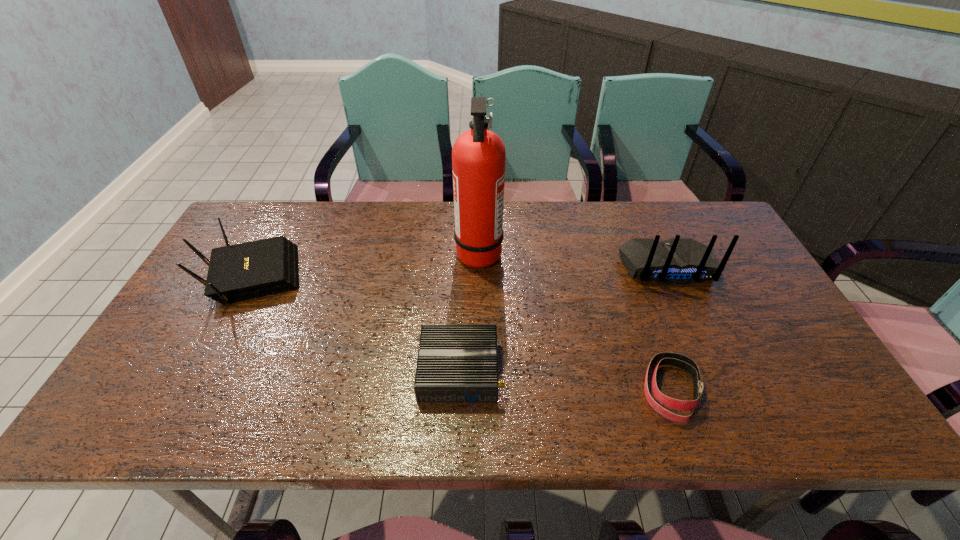
This screenshot has width=960, height=540. I want to click on vacant space at the far edge, so click(550, 228).

The height and width of the screenshot is (540, 960). Find the location of `free space at the left edge`. free space at the left edge is located at coordinates (159, 348).

In the image, there is a desktop. Find the location of `vacant space at the right edge`. vacant space at the right edge is located at coordinates (777, 374).

This screenshot has height=540, width=960. Identify the location of vacant area that lies between the shortest router and the fire extinguisher. (469, 311).

Locate an element on the screen. The image size is (960, 540). empty location between the second shortest object and the second tallest object is located at coordinates (564, 318).

Identify the location of blank region between the rightmost router and the leftmost object. The width and height of the screenshot is (960, 540). (459, 272).

At what (x,y) coordinates should I click in order to perform the action: click on vacant area that lies between the second router from right to left and the fire extinguisher. Please return your answer as a coordinate pair (x, y). The height and width of the screenshot is (540, 960). Looking at the image, I should click on coord(469,311).

This screenshot has width=960, height=540. What are the coordinates of `vacant space that is in between the tallest router and the fire extinguisher` in the screenshot? It's located at (573, 259).

Locate an element on the screen. The width and height of the screenshot is (960, 540). vacant region between the tallest object and the leftmost router is located at coordinates (365, 265).

Locate an element on the screen. empty space that is in between the dog collar and the shortest router is located at coordinates (565, 380).